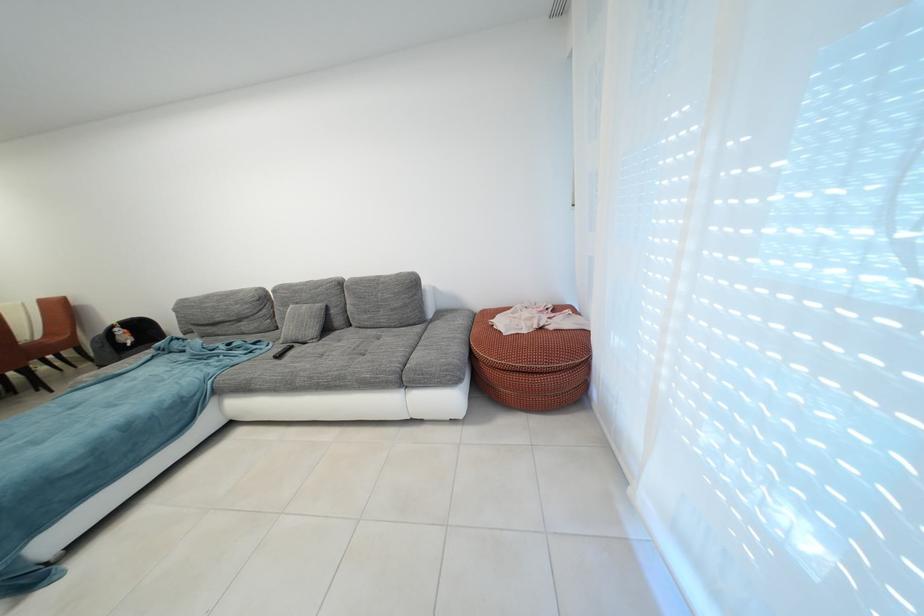
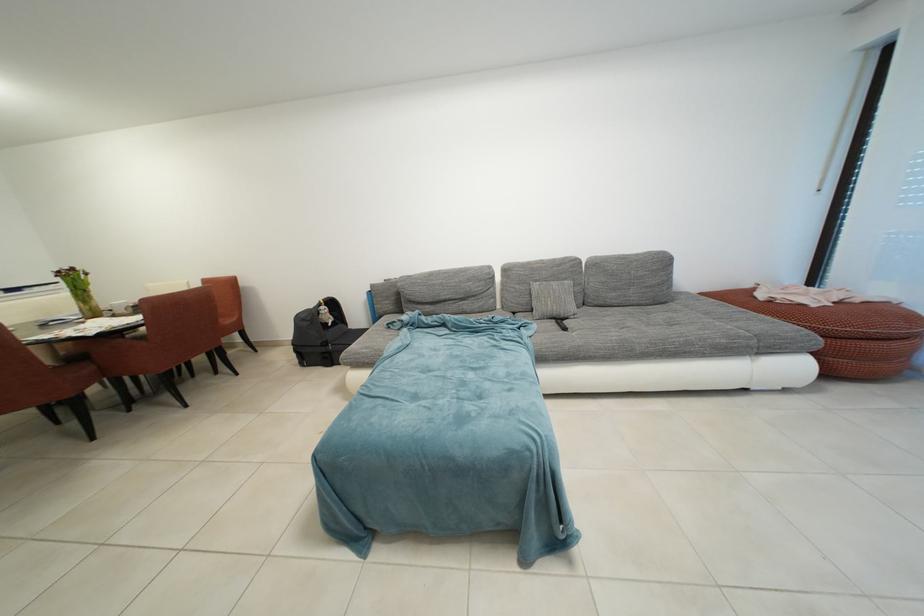
Question: I am providing you with two images of the same scene from different viewpoints. Please identify which objects are invisible in image2.

Choices:
 (A) glass flower vase
 (B) small grey cushion
 (C) black remote control
 (D) none of these

Answer: (D)